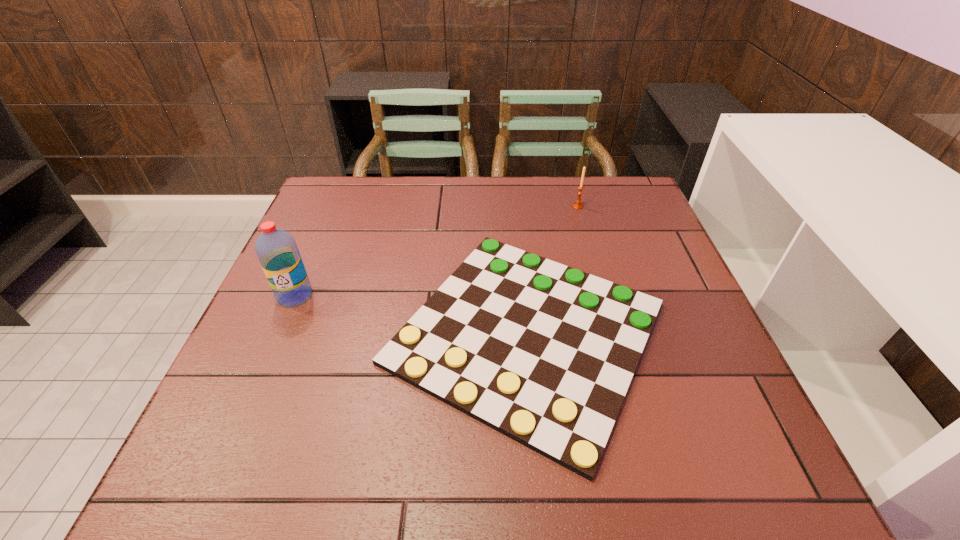
Identify the location of vacant region between the shortest object and the water bottle. This screenshot has width=960, height=540. (411, 314).

At what (x,y) coordinates should I click in order to perform the action: click on free spot between the second shortest object and the leftmost object. Please return your answer as a coordinate pair (x, y). Looking at the image, I should click on (437, 251).

Locate an element on the screen. empty space between the leftmost object and the checkerboard is located at coordinates (411, 314).

This screenshot has height=540, width=960. Find the location of `free area in between the checkerboard and the tallest object`. free area in between the checkerboard and the tallest object is located at coordinates (411, 314).

The width and height of the screenshot is (960, 540). I want to click on free space between the farthest object and the tallest object, so click(x=437, y=251).

Find the location of `unoccupied area between the leftmost object and the second tallest object`. unoccupied area between the leftmost object and the second tallest object is located at coordinates (437, 251).

The image size is (960, 540). Identify the location of the closest object to the shortest object. pos(577,205).

Where is `object that can be found as the closest to the candle_holder`? The width and height of the screenshot is (960, 540). object that can be found as the closest to the candle_holder is located at coordinates (543, 353).

Image resolution: width=960 pixels, height=540 pixels. Find the location of `free region that satisfies the following two spatial constraints: 1. on the front label of the shortest object; 2. on the right side of the leftmost object`. free region that satisfies the following two spatial constraints: 1. on the front label of the shortest object; 2. on the right side of the leftmost object is located at coordinates (278, 333).

The width and height of the screenshot is (960, 540). Identify the location of vacant position in the image that satisfies the following two spatial constraints: 1. on the front label of the checkerboard; 2. on the right side of the leftmost object. (278, 333).